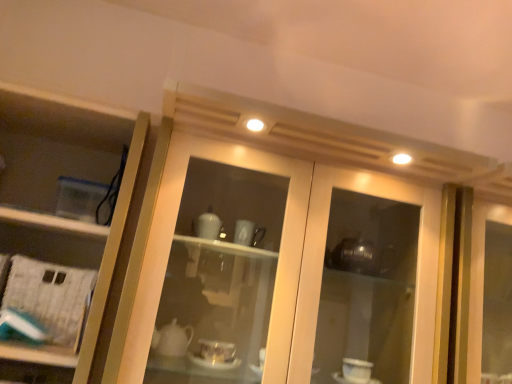
Question: Can you confirm if matte glass cabinet at center is thinner than clear plastic container at left?

Choices:
 (A) yes
 (B) no

Answer: (B)

Question: Is matte glass cabinet at center positioned with its back to clear plastic container at left?

Choices:
 (A) no
 (B) yes

Answer: (A)

Question: Is matte glass cabinet at center wider than clear plastic container at left?

Choices:
 (A) yes
 (B) no

Answer: (A)

Question: Considering the relative sizes of matte glass cabinet at center and clear plastic container at left in the image provided, is matte glass cabinet at center taller than clear plastic container at left?

Choices:
 (A) yes
 (B) no

Answer: (A)

Question: Would you say matte glass cabinet at center is outside clear plastic container at left?

Choices:
 (A) yes
 (B) no

Answer: (A)

Question: Relative to white paper at left, is matte glass cabinet at center in front or behind?

Choices:
 (A) front
 (B) behind

Answer: (A)

Question: From the image's perspective, relative to white paper at left, is matte glass cabinet at center above or below?

Choices:
 (A) below
 (B) above

Answer: (B)

Question: From a real-world perspective, is matte glass cabinet at center above or below white paper at left?

Choices:
 (A) above
 (B) below

Answer: (A)

Question: Looking at their shapes, would you say matte glass cabinet at center is wider or thinner than white paper at left?

Choices:
 (A) wide
 (B) thin

Answer: (A)

Question: Considering their positions, is clear plastic container at left located in front of or behind matte glass cabinet at center?

Choices:
 (A) behind
 (B) front

Answer: (A)

Question: Is clear plastic container at left inside the boundaries of matte glass cabinet at center, or outside?

Choices:
 (A) outside
 (B) inside

Answer: (A)

Question: Considering the positions of clear plastic container at left and matte glass cabinet at center in the image, is clear plastic container at left taller or shorter than matte glass cabinet at center?

Choices:
 (A) short
 (B) tall

Answer: (A)

Question: From a real-world perspective, is clear plastic container at left positioned above or below matte glass cabinet at center?

Choices:
 (A) above
 (B) below

Answer: (B)

Question: Based on their sizes in the image, would you say white paper at left is bigger or smaller than clear plastic container at left?

Choices:
 (A) big
 (B) small

Answer: (B)

Question: In the image, is white paper at left positioned in front of or behind clear plastic container at left?

Choices:
 (A) front
 (B) behind

Answer: (B)